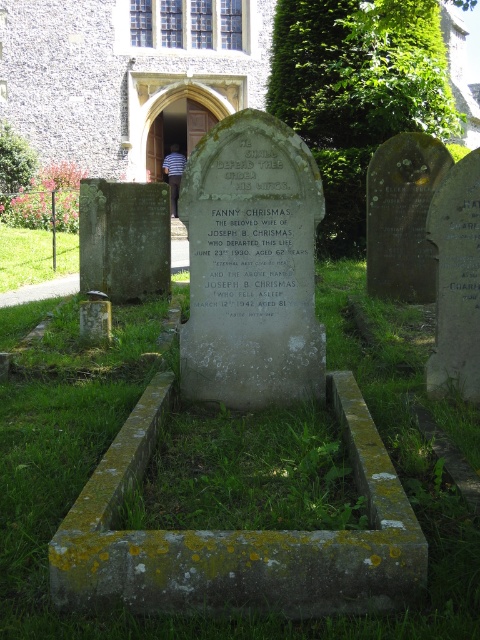
You are standing in the churchyard and want to walk from the green grass at lower left to the central gravestone. Which direction should you walk to avoid stepping on the green mossy grass at center?

To avoid stepping on the green mossy grass at center, you should walk around it by moving to the side opposite of the green grass at lower left since the green mossy grass at center is in front of the green grass at lower left.